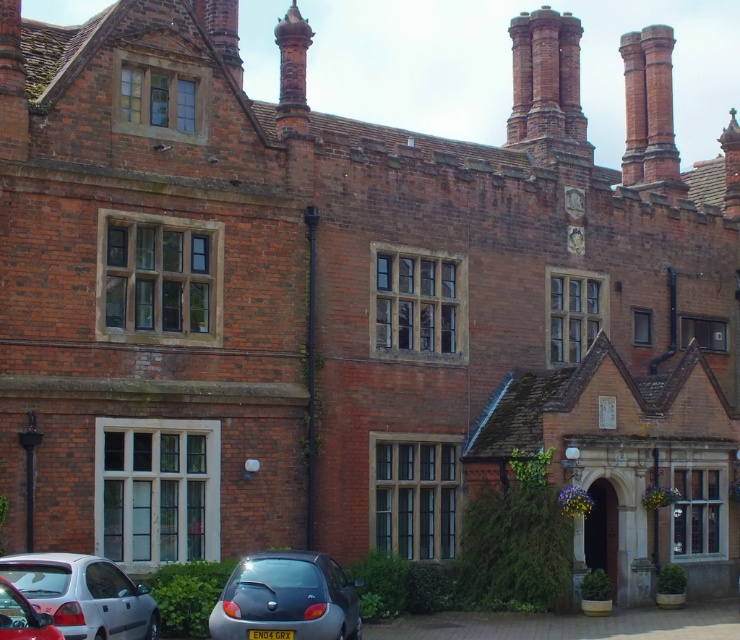
Can you confirm if silver metallic hatchback at lower left is thinner than red brick chimney at upper right?

Indeed, silver metallic hatchback at lower left has a lesser width compared to red brick chimney at upper right.

Who is more distant from viewer, (50,577) or (625,68)?

Point (625,68)

At what (x,y) coordinates should I click in order to perform the action: click on silver metallic hatchback at lower left. Please return your answer as a coordinate pair (x, y). The width and height of the screenshot is (740, 640). Looking at the image, I should click on (84, 595).

Which is above, metallic gray car at lower left or red brick chimney at upper right?

Positioned higher is red brick chimney at upper right.

Can you confirm if metallic gray car at lower left is taller than red brick chimney at upper right?

In fact, metallic gray car at lower left may be shorter than red brick chimney at upper right.

Between point (303, 570) and point (669, 186), which one is positioned in front?

Point (303, 570) is in front.

Where is `metallic gray car at lower left`? Image resolution: width=740 pixels, height=640 pixels. metallic gray car at lower left is located at coordinates (286, 600).

Between metallic gray car at lower left and silver metallic hatchback at lower left, which one appears on the left side from the viewer's perspective?

silver metallic hatchback at lower left is more to the left.

Can you confirm if metallic gray car at lower left is bigger than silver metallic hatchback at lower left?

Actually, metallic gray car at lower left might be smaller than silver metallic hatchback at lower left.

In order to click on metallic gray car at lower left in this screenshot , I will do `click(286, 600)`.

Image resolution: width=740 pixels, height=640 pixels. In order to click on metallic gray car at lower left in this screenshot , I will do `click(286, 600)`.